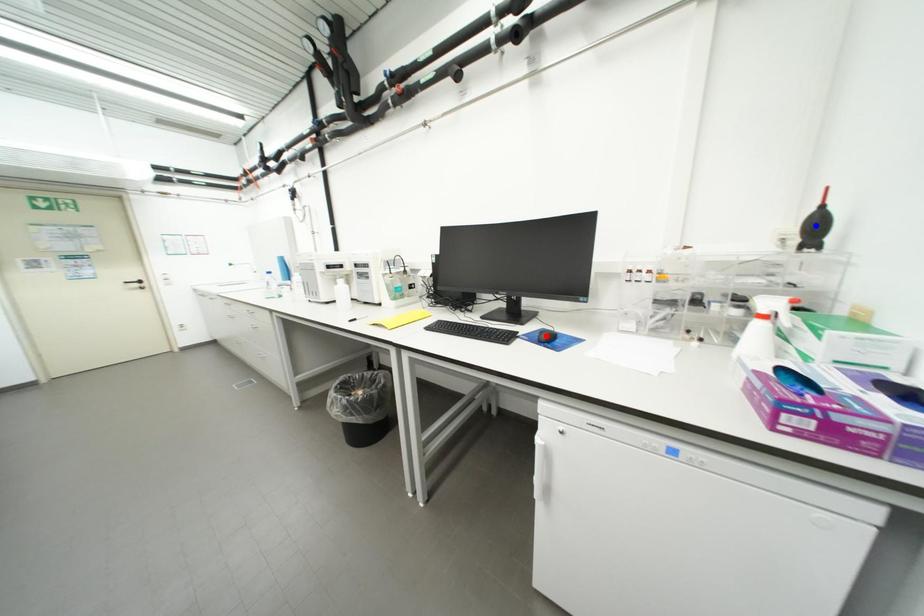
Question: Which of the two points in the image is closer to the camera?

Choices:
 (A) Blue point is closer.
 (B) Red point is closer.

Answer: (A)